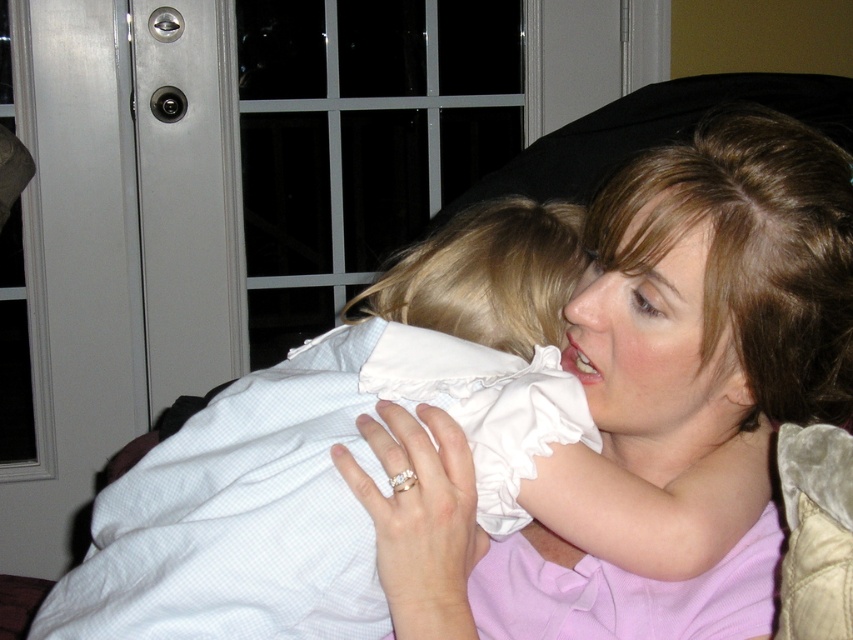
Question: Can you confirm if matte white shirt at center is smaller than white cotton dress at center?

Choices:
 (A) no
 (B) yes

Answer: (B)

Question: Does matte white shirt at center have a smaller size compared to white cotton dress at center?

Choices:
 (A) yes
 (B) no

Answer: (A)

Question: Is the position of matte white shirt at center more distant than that of white cotton dress at center?

Choices:
 (A) yes
 (B) no

Answer: (A)

Question: Which point is closer to the camera taking this photo?

Choices:
 (A) (212, 500)
 (B) (714, 259)

Answer: (A)

Question: Which of the following is the closest to the observer?

Choices:
 (A) (577, 576)
 (B) (479, 440)

Answer: (B)

Question: Which point is farther to the camera?

Choices:
 (A) matte white shirt at center
 (B) white cotton dress at center

Answer: (A)